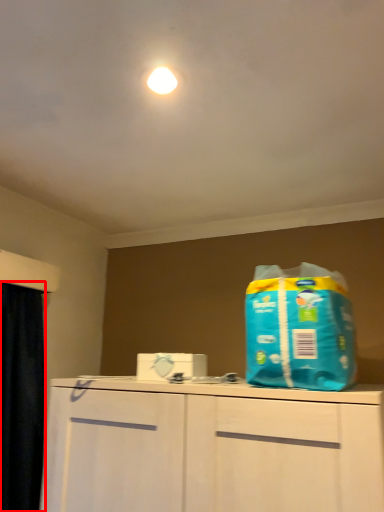
Question: Where is curtain (annotated by the red box) located in relation to cleaning product in the image?

Choices:
 (A) right
 (B) left

Answer: (B)